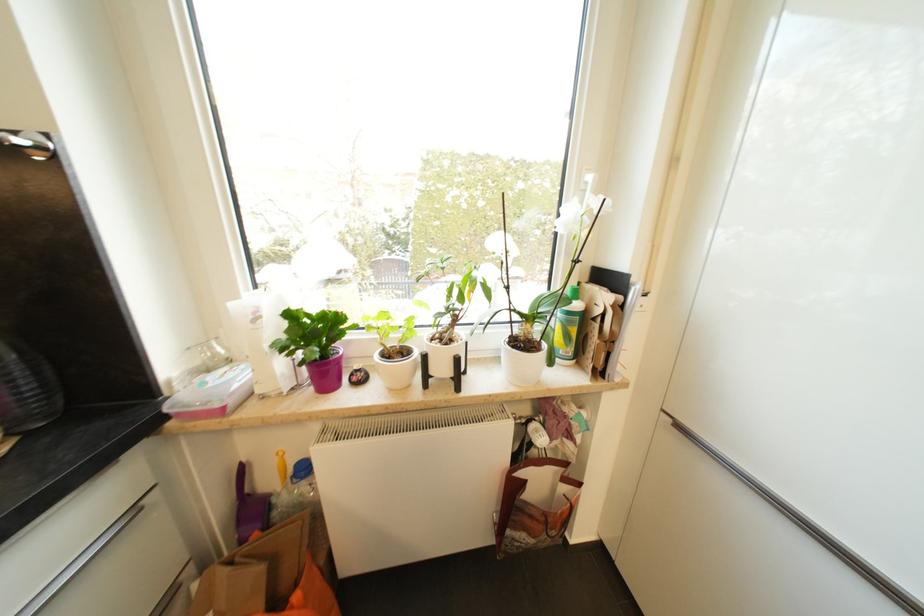
What do you see at coordinates (573, 314) in the screenshot? I see `a bottle pump top` at bounding box center [573, 314].